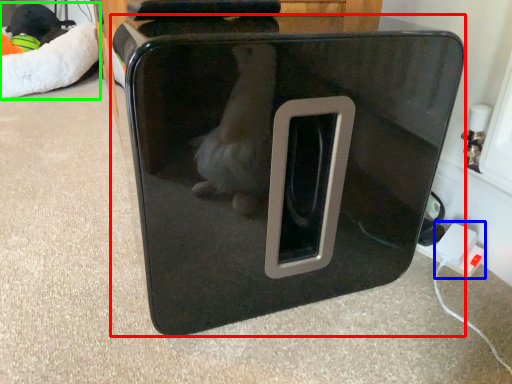
Question: Estimate the real-world distances between objects in this image. Which object is farther from home appliance (highlighted by a red box), electric outlet (highlighted by a blue box) or bean bag chair (highlighted by a green box)?

Choices:
 (A) electric outlet
 (B) bean bag chair

Answer: (B)